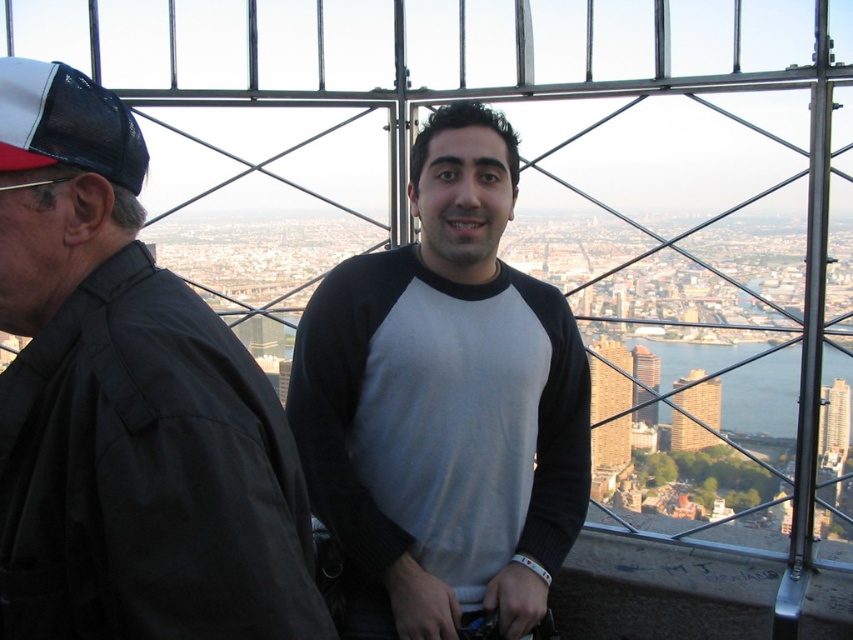
In the scene shown: Between brown brick building at center and glassy reflective skyscraper at center, which one has more height?

brown brick building at center is taller.

Is brown brick building at center positioned before glassy reflective skyscraper at center?

Yes, it is.

Does point (601, 449) lie behind point (705, 413)?

No, it is not.

The image size is (853, 640). I want to click on brown brick building at center, so click(610, 404).

Who is more forward, (531, 620) or (685, 442)?

Point (531, 620)

Is gray/black raglan shirt at center to the left of glassy reflective skyscraper at center from the viewer's perspective?

Yes, gray/black raglan shirt at center is to the left of glassy reflective skyscraper at center.

Is point (396, 397) positioned after point (698, 426)?

No, (396, 397) is in front of (698, 426).

This screenshot has height=640, width=853. I want to click on gray/black raglan shirt at center, so (444, 404).

Can you confirm if dark gray shirt at left is positioned to the right of brown brick building at center?

In fact, dark gray shirt at left is to the left of brown brick building at center.

Does dark gray shirt at left have a larger size compared to brown brick building at center?

Yes.

The height and width of the screenshot is (640, 853). I want to click on dark gray shirt at left, so click(126, 406).

Where is `dark gray shirt at left`? dark gray shirt at left is located at coordinates (126, 406).